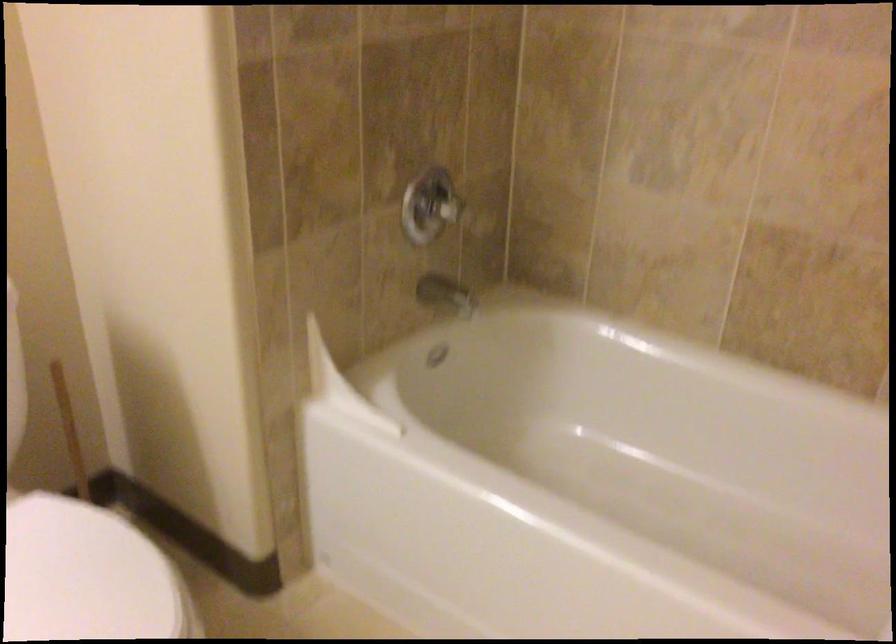
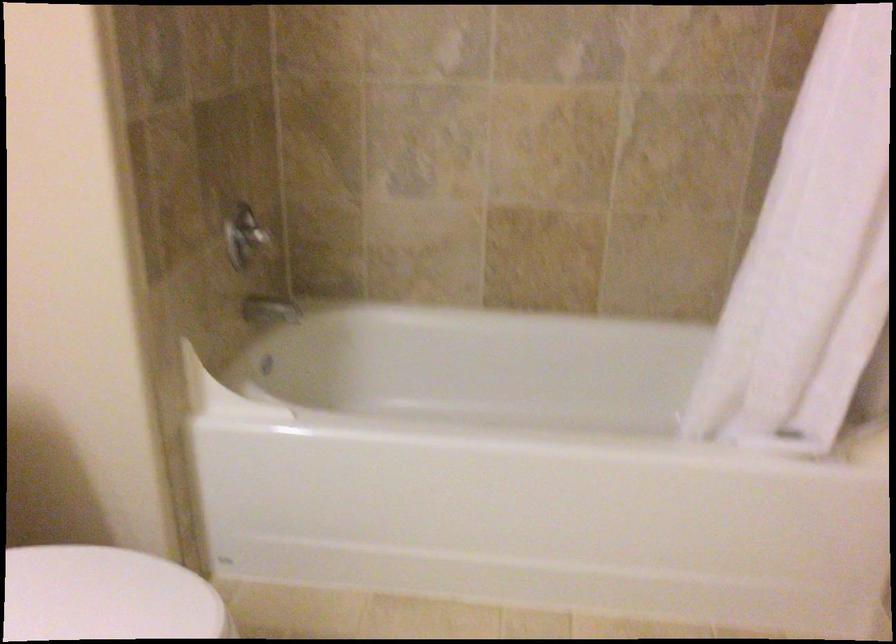
What movement of the cameraman would produce the second image?

The cameraman moved toward left, backward.